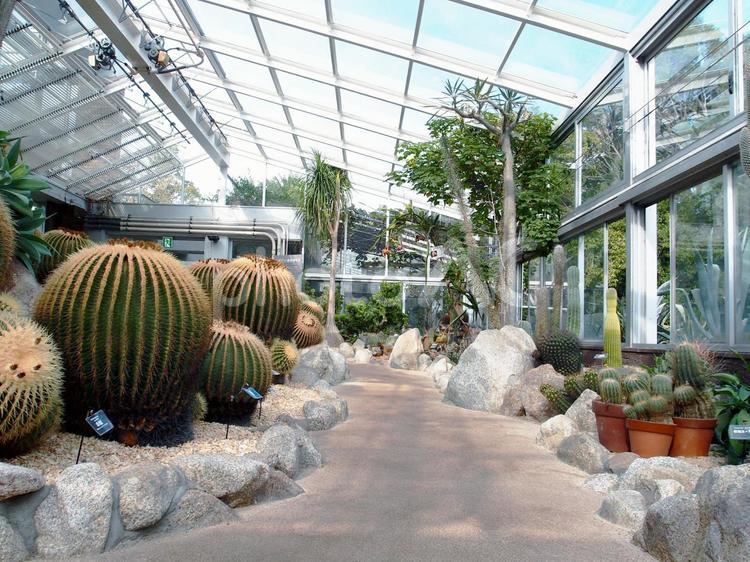
Where is `pot`? pot is located at coordinates (692, 446).